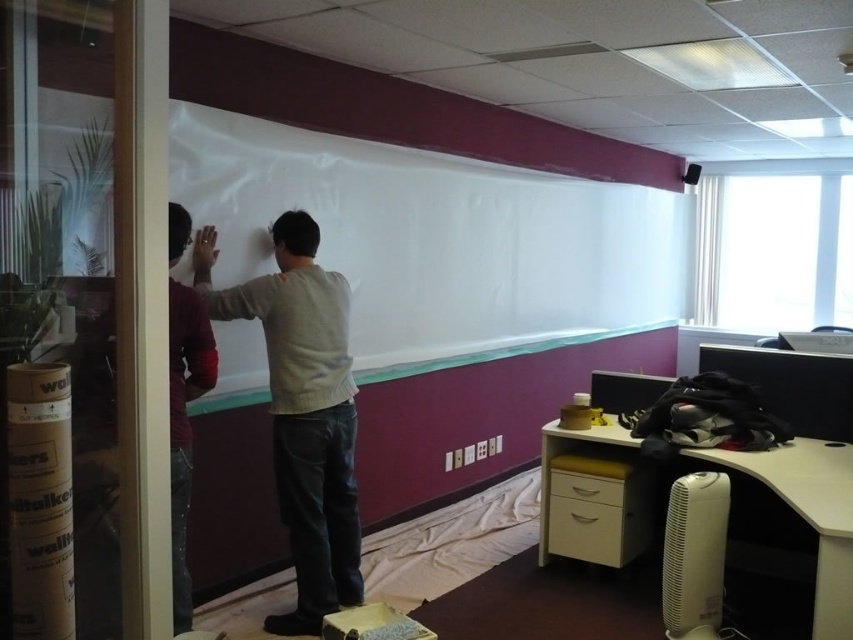
Does white matte board at center appear on the left side of maroon sweater at left?

In fact, white matte board at center is to the right of maroon sweater at left.

Locate an element on the screen. This screenshot has width=853, height=640. white matte board at center is located at coordinates (438, 241).

This screenshot has height=640, width=853. In order to click on white matte board at center in this screenshot , I will do 438,241.

Is light gray sweater at center in front of maroon sweater at left?

That is False.

Between light gray sweater at center and maroon sweater at left, which one is positioned lower?

Positioned lower is light gray sweater at center.

Who is more forward, (303, 220) or (178, 212)?

Positioned in front is point (178, 212).

Identify the location of light gray sweater at center. Image resolution: width=853 pixels, height=640 pixels. (303, 412).

Can you confirm if white matte board at center is positioned to the right of light gray sweater at center?

Indeed, white matte board at center is positioned on the right side of light gray sweater at center.

Looking at this image, is white matte board at center further to camera compared to light gray sweater at center?

That is True.

Which is in front, point (570, 321) or point (305, 536)?

Point (305, 536) is more forward.

What are the coordinates of `white matte board at center` in the screenshot? It's located at (438, 241).